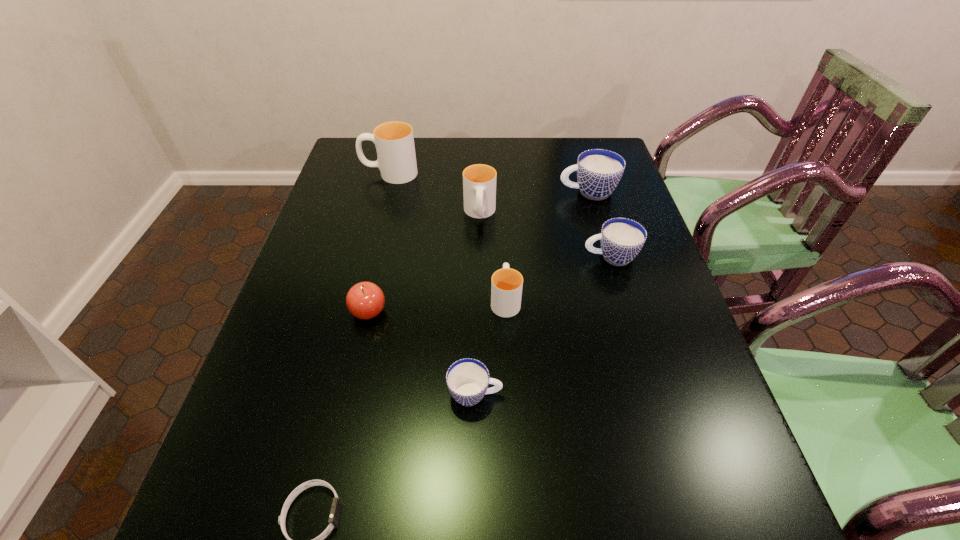
Locate an element on the screen. This screenshot has width=960, height=540. the tallest cup is located at coordinates (394, 141).

Where is `the farthest yellow cup`? the farthest yellow cup is located at coordinates (394, 141).

The width and height of the screenshot is (960, 540). Identify the location of the second biggest yellow cup. (479, 181).

What are the coordinates of `the farthest blue cup` in the screenshot? It's located at (599, 171).

Where is `apple`? This screenshot has width=960, height=540. apple is located at coordinates (365, 300).

Where is `the smallest yellow cup`? the smallest yellow cup is located at coordinates (506, 286).

This screenshot has width=960, height=540. I want to click on the fifth farthest cup, so click(x=506, y=286).

What are the coordinates of `the fourth farthest cup` in the screenshot? It's located at (621, 239).

Find the location of a particular element. This screenshot has width=960, height=540. the second nearest blue cup is located at coordinates (621, 239).

I want to click on the second shortest object, so click(x=467, y=379).